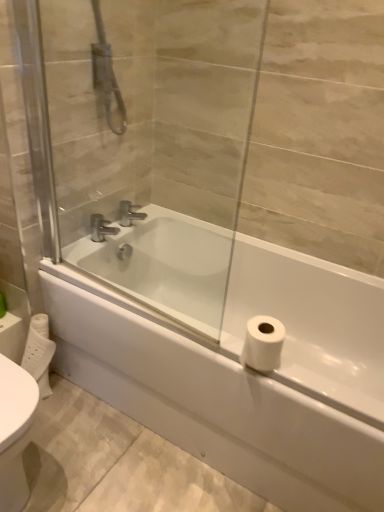
Question: Which direction should I rotate to look at silver metallic faucet at center, the 2th tap from the right?

Choices:
 (A) left
 (B) right

Answer: (A)

Question: Should I look upward or downward to see transparent glass screen door at upper center?

Choices:
 (A) up
 (B) down

Answer: (A)

Question: Can you confirm if silver metallic faucet at center, the 2th tap from the right, is positioned to the right of chrome metallic faucet at upper center, which is the first tap from right to left?

Choices:
 (A) yes
 (B) no

Answer: (B)

Question: Is silver metallic faucet at center, the 2th tap from the right, outside chrome metallic faucet at upper center, which is the first tap from right to left?

Choices:
 (A) no
 (B) yes

Answer: (B)

Question: Is silver metallic faucet at center, marked as the 1th tap in a left-to-right arrangement, taller than chrome metallic faucet at upper center, which appears as the second tap when viewed from the left?

Choices:
 (A) no
 (B) yes

Answer: (B)

Question: Is silver metallic faucet at center, marked as the 1th tap in a left-to-right arrangement, positioned in front of chrome metallic faucet at upper center, which appears as the second tap when viewed from the left?

Choices:
 (A) yes
 (B) no

Answer: (A)

Question: From a real-world perspective, is silver metallic faucet at center, the 2th tap from the right, below chrome metallic faucet at upper center, which appears as the second tap when viewed from the left?

Choices:
 (A) yes
 (B) no

Answer: (A)

Question: From a real-world perspective, is silver metallic faucet at center, the 2th tap from the right, positioned over chrome metallic faucet at upper center, which appears as the second tap when viewed from the left, based on gravity?

Choices:
 (A) yes
 (B) no

Answer: (B)

Question: Is transparent glass screen door at upper center positioned in front of white glossy bathtub at center?

Choices:
 (A) yes
 (B) no

Answer: (A)

Question: Can you confirm if transparent glass screen door at upper center is taller than white glossy bathtub at center?

Choices:
 (A) no
 (B) yes

Answer: (B)

Question: Is transparent glass screen door at upper center surrounding white glossy bathtub at center?

Choices:
 (A) yes
 (B) no

Answer: (B)

Question: Could you tell me if transparent glass screen door at upper center is facing white glossy bathtub at center?

Choices:
 (A) yes
 (B) no

Answer: (B)

Question: From the image's perspective, would you say transparent glass screen door at upper center is shown under white glossy bathtub at center?

Choices:
 (A) no
 (B) yes

Answer: (A)

Question: From a real-world perspective, is transparent glass screen door at upper center below white glossy bathtub at center?

Choices:
 (A) no
 (B) yes

Answer: (A)

Question: Is chrome metallic faucet at upper center, which appears as the second tap when viewed from the left, positioned far away from white glossy bathtub at center?

Choices:
 (A) no
 (B) yes

Answer: (A)